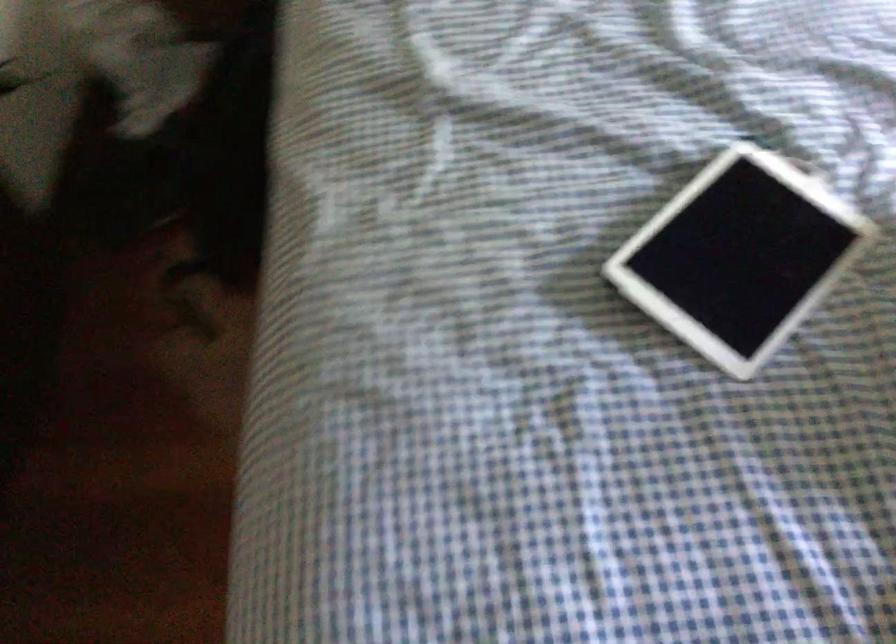
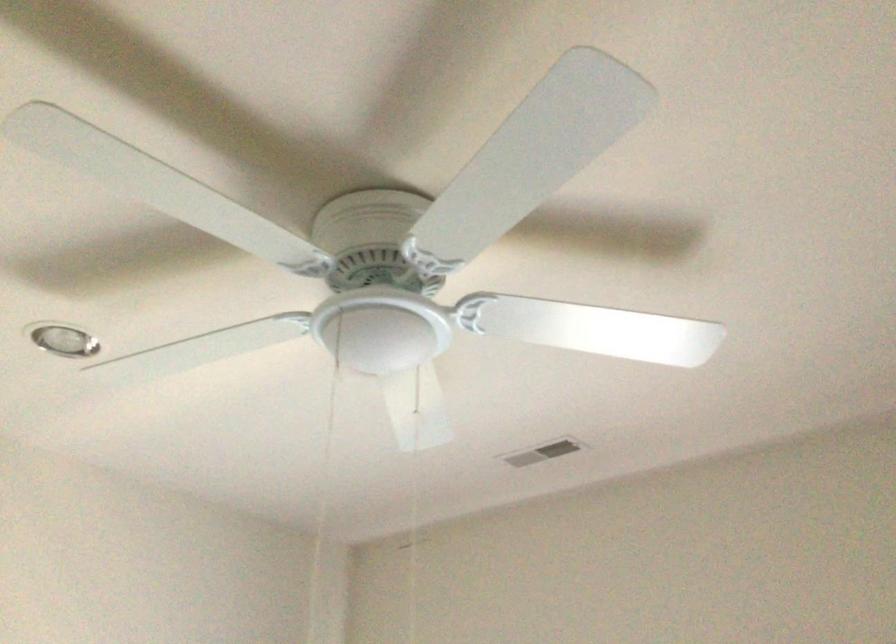
Based on the continuous images, in which direction is the camera rotating?

The camera rotated toward right-up.